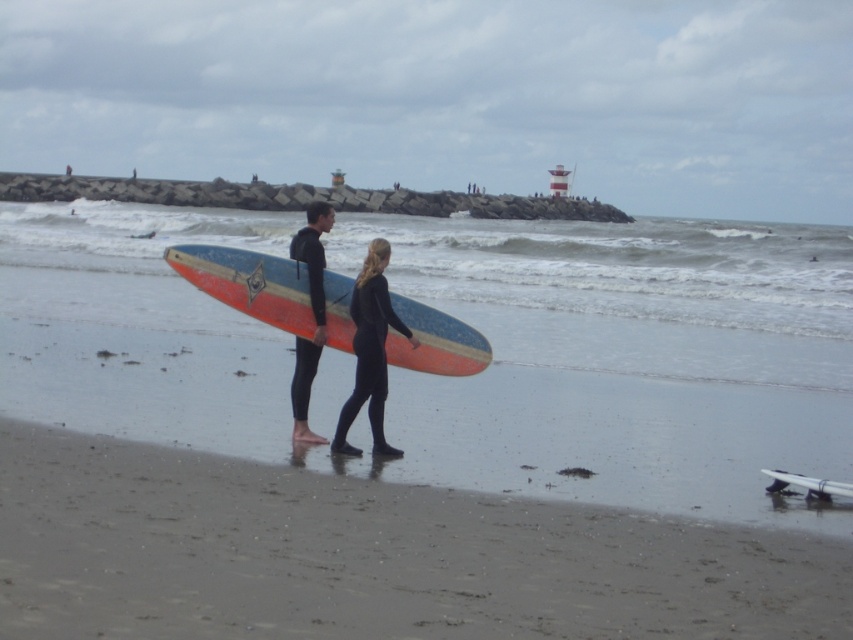
How much distance is there between matte wood surfboard at center and wooden surfboard at center?

matte wood surfboard at center and wooden surfboard at center are 11.45 feet apart.

Is point (303, 616) positioned before point (193, 256)?

That is True.

The image size is (853, 640). What are the coordinates of `matte wood surfboard at center` in the screenshot? It's located at (389, 490).

Consider the image. Can you confirm if matte wood surfboard at center is positioned above black wetsuit at center?

Yes, matte wood surfboard at center is above black wetsuit at center.

Which is more to the left, matte wood surfboard at center or black wetsuit at center?

matte wood surfboard at center is more to the left.

Which is in front, point (239, 429) or point (311, 257)?

Positioned in front is point (311, 257).

Identify the location of matte wood surfboard at center. (389, 490).

Is wooden surfboard at center to the left of black wetsuit at center from the viewer's perspective?

Yes, wooden surfboard at center is to the left of black wetsuit at center.

Which is in front, point (346, 314) or point (323, 307)?

Point (323, 307) is more forward.

Image resolution: width=853 pixels, height=640 pixels. I want to click on wooden surfboard at center, so click(248, 284).